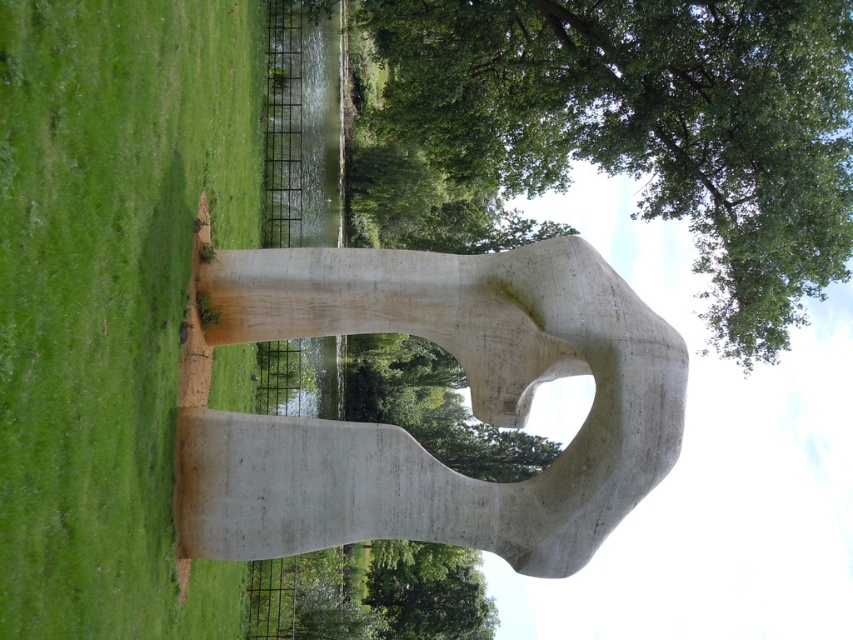
You are a photographer planning to take a picture of the smooth concrete sculpture at center and the green leafy tree at upper center. To ensure both are in the frame, where should you position yourself relative to the sculpture and the tree?

You should position yourself to the right side of the smooth concrete sculpture at center and the green leafy tree at upper center so that both are visible in the frame since the sculpture is on the left side of the tree.